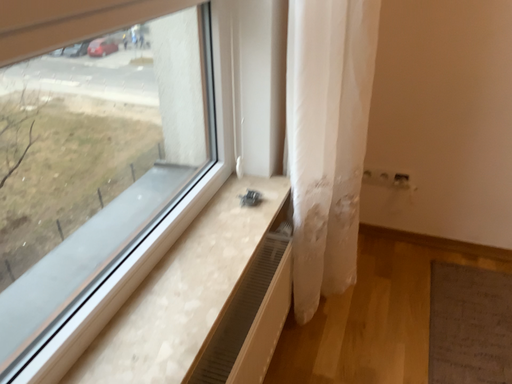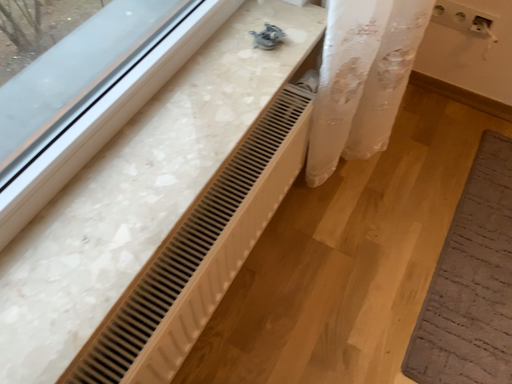
Question: Which way did the camera rotate in the video?

Choices:
 (A) rotated downward
 (B) rotated upward

Answer: (A)